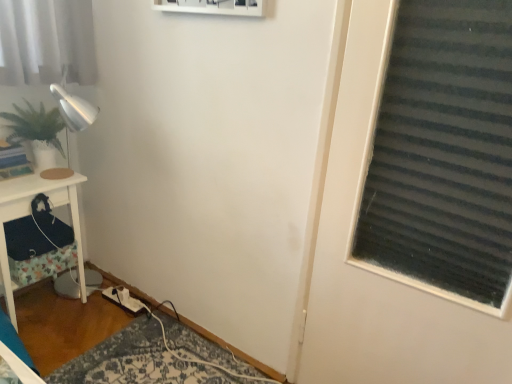
Image resolution: width=512 pixels, height=384 pixels. I want to click on free space in front of white fabric extension cord at lower left, so click(113, 324).